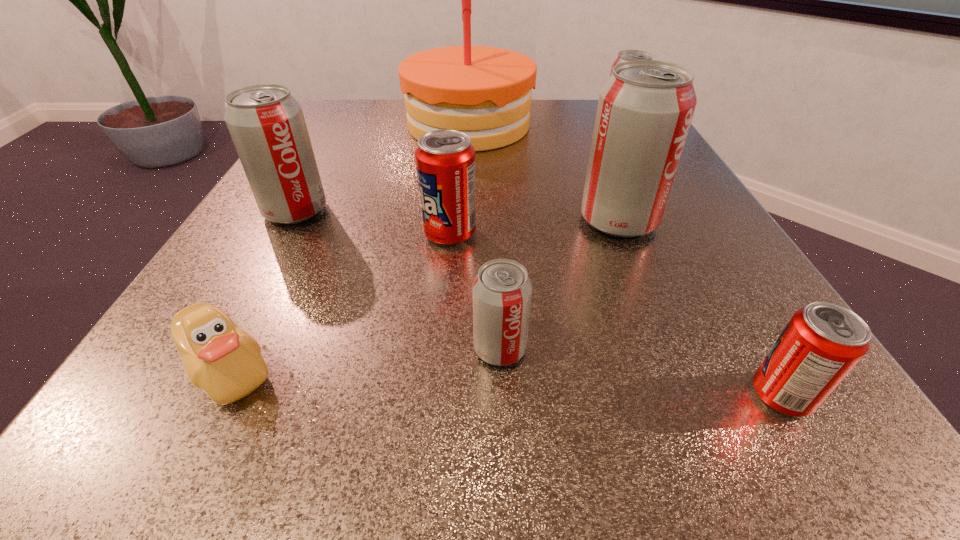
Find the location of a particular element. vacant area that lies between the beige duck and the leftmost soda can is located at coordinates (262, 290).

The width and height of the screenshot is (960, 540). In order to click on vacant space in between the right red soda can and the second biggest gray soda can in this screenshot , I will do `click(539, 303)`.

The height and width of the screenshot is (540, 960). Find the location of `free space that is in between the beige duck and the second gray soda can from left to right`. free space that is in between the beige duck and the second gray soda can from left to right is located at coordinates (364, 359).

I want to click on empty location between the fifth farthest soda can and the nearer red soda can, so click(x=640, y=372).

Locate an element on the screen. This screenshot has height=540, width=960. vacant area that lies between the farthest soda can and the nearest gray soda can is located at coordinates (560, 239).

Choose which object is the fourth nearest neighbor to the biggest gray soda can. Please provide its 2D coordinates. Your answer should be formatted as a tuple, i.e. [(x, y)], where the tuple contains the x and y coordinates of a point satisfying the conditions above.

[(822, 342)]

Locate which object ranks seventh in proximity to the birthday cake. Please provide its 2D coordinates. Your answer should be formatted as a tuple, i.e. [(x, y)], where the tuple contains the x and y coordinates of a point satisfying the conditions above.

[(822, 342)]

Image resolution: width=960 pixels, height=540 pixels. Identify the location of soda can that is the third closest to the nearer red soda can. (445, 160).

Locate which soda can ranks fifth in proximity to the beige duck. Please provide its 2D coordinates. Your answer should be formatted as a tuple, i.e. [(x, y)], where the tuple contains the x and y coordinates of a point satisfying the conditions above.

[(822, 342)]

This screenshot has width=960, height=540. What are the coordinates of `the fourth closest gray soda can relative to the duck` in the screenshot? It's located at (626, 55).